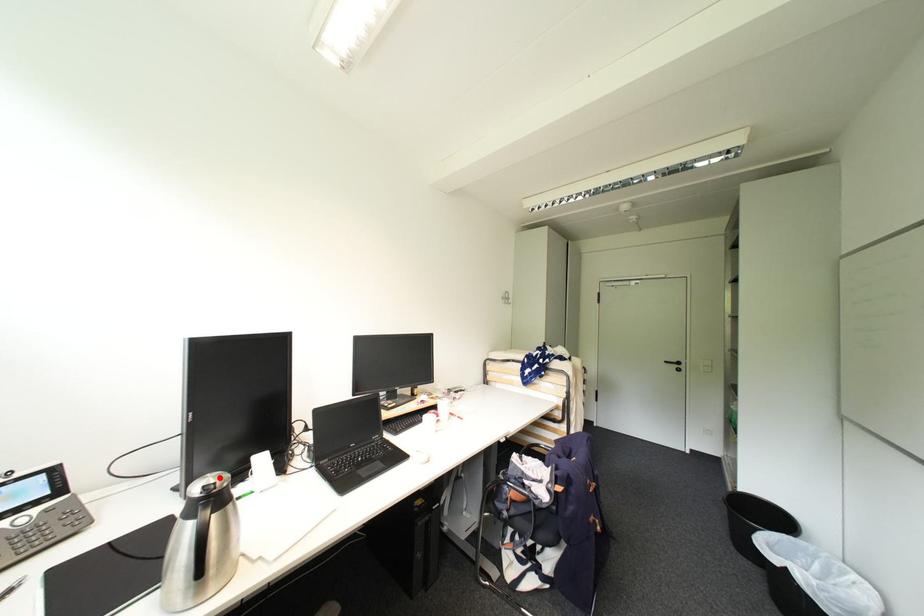
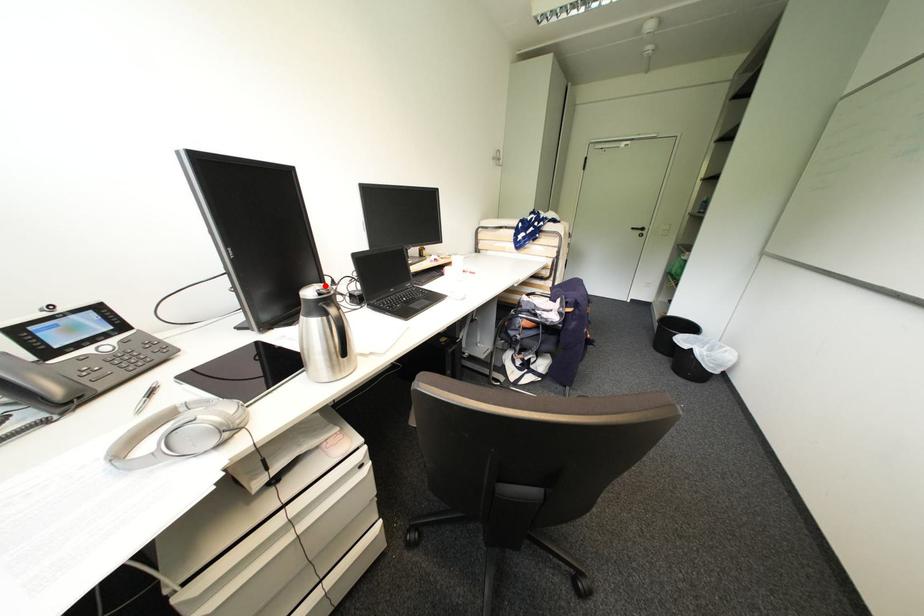
I am providing you with two images of the same scene from different viewpoints. A red point is marked on the first image and another point is marked on the second image. Are the points marked in image1 and image2 representing the same 3D position?

Yes